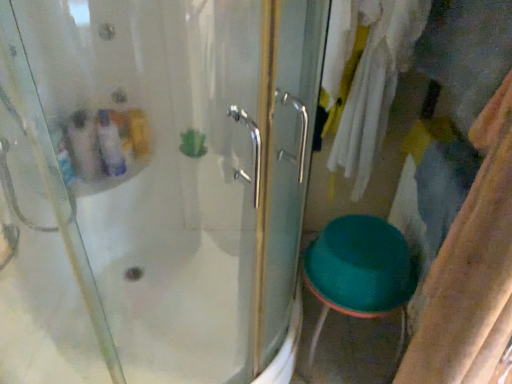
Question: From the image's perspective, relative to teal plastic stool at lower right, is green plastic stool at lower right above or below?

Choices:
 (A) above
 (B) below

Answer: (A)

Question: Considering the positions of green plastic stool at lower right and teal plastic stool at lower right in the image, is green plastic stool at lower right taller or shorter than teal plastic stool at lower right?

Choices:
 (A) short
 (B) tall

Answer: (B)

Question: In the image, is green plastic stool at lower right positioned in front of or behind teal plastic stool at lower right?

Choices:
 (A) behind
 (B) front

Answer: (B)

Question: From their relative heights in the image, would you say teal plastic stool at lower right is taller or shorter than green plastic stool at lower right?

Choices:
 (A) short
 (B) tall

Answer: (A)

Question: Considering the positions of point (330, 235) and point (221, 372), is point (330, 235) closer or farther from the camera than point (221, 372)?

Choices:
 (A) closer
 (B) farther

Answer: (A)

Question: Is teal plastic stool at lower right inside the boundaries of green plastic stool at lower right, or outside?

Choices:
 (A) outside
 (B) inside

Answer: (A)

Question: From the image's perspective, is teal plastic stool at lower right located above or below green plastic stool at lower right?

Choices:
 (A) below
 (B) above

Answer: (A)